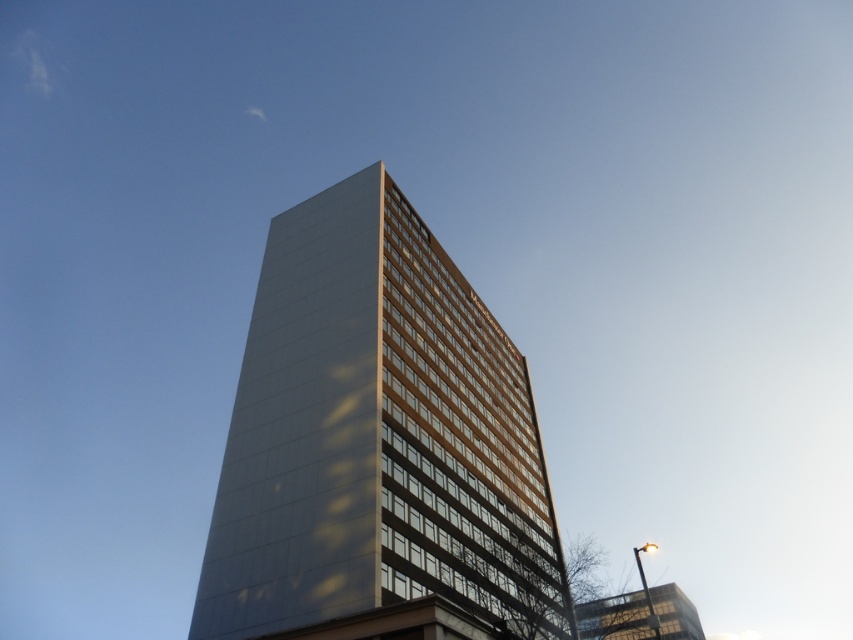
You are standing in front of the modern building and notice two points marked on the facade. The first point is at coordinates point (363,573) and the second is at point (682,618). Which point is closer to you?

Point (363,573) is in front of point (682,618), so it is closer to you.

You are an urban planner reviewing a cityscape design. You notice two buildings in the scene, the matte glass tower at center and the clear glass building at lower right. Which building takes up more area in the image?

The clear glass building at lower right occupies more space in the image than the matte glass tower at center.

You are standing at the base of the matte glass tower at center and want to walk to the clear glass building at lower right. Which direction should you move relative to the building?

You should move to the right relative to the matte glass tower at center because the clear glass building at lower right is located to the right of it.